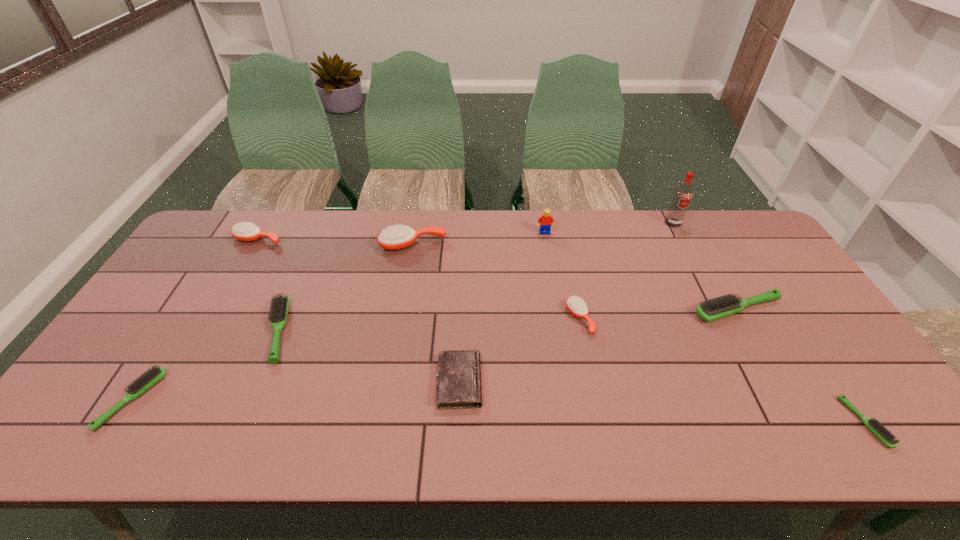
Identify which orange hairbrush is located as the second nearest to the leftmost orange hairbrush. Please provide its 2D coordinates. Your answer should be formatted as a tuple, i.e. [(x, y)], where the tuple contains the x and y coordinates of a point satisfying the conditions above.

[(576, 305)]

I want to click on orange hairbrush that is the closest to the leftmost orange hairbrush, so click(x=398, y=237).

Select which light hairbrush appears as the third closest to the leftmost orange hairbrush. Please provide its 2D coordinates. Your answer should be formatted as a tuple, i.e. [(x, y)], where the tuple contains the x and y coordinates of a point satisfying the conditions above.

[(712, 309)]

Identify the location of light hairbrush that is the fourth closest to the diary. The width and height of the screenshot is (960, 540). (886, 437).

The image size is (960, 540). What are the coordinates of `vacant area in the image that satisfies the following two spatial constraints: 1. on the front side of the shortest object; 2. on the left side of the biggest orange hairbrush` in the screenshot? It's located at click(383, 422).